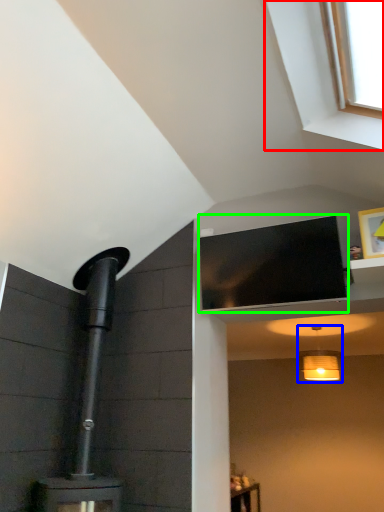
Question: Considering the real-world distances, which object is closest to window (highlighted by a red box)? light fixture (highlighted by a blue box) or window screen (highlighted by a green box).

Choices:
 (A) light fixture
 (B) window screen

Answer: (B)